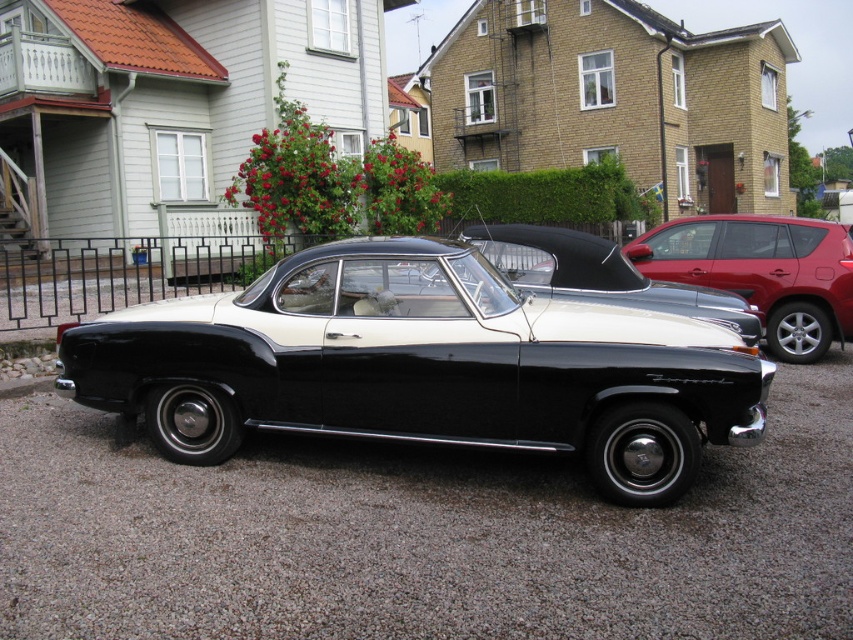
Question: Is black glossy car at center wider than glossy red suv at right?

Choices:
 (A) yes
 (B) no

Answer: (A)

Question: Which point is farther from the camera taking this photo?

Choices:
 (A) (631, 484)
 (B) (834, 262)

Answer: (B)

Question: Is black glossy car at center further to the viewer compared to glossy red suv at right?

Choices:
 (A) yes
 (B) no

Answer: (B)

Question: Does black glossy car at center appear over glossy red suv at right?

Choices:
 (A) no
 (B) yes

Answer: (A)